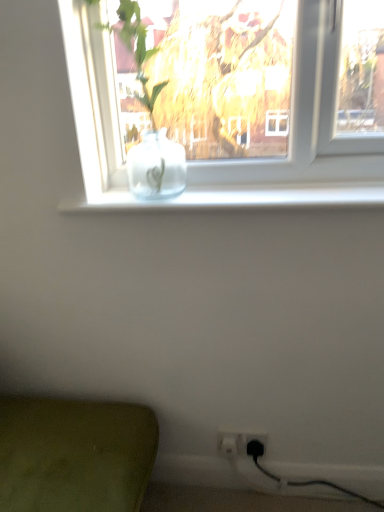
What do you see at coordinates (255, 445) in the screenshot? This screenshot has height=512, width=384. I see `white plastic electric outlet at lower right, which is the second electric outlet in left-to-right order` at bounding box center [255, 445].

What is the approximate width of white plastic electric outlet at lower right, marked as the 1th electric outlet in a right-to-left arrangement?

0.97 inches.

Where is `white plastic electric outlet at lower right, marked as the 1th electric outlet in a right-to-left arrangement`? This screenshot has width=384, height=512. white plastic electric outlet at lower right, marked as the 1th electric outlet in a right-to-left arrangement is located at coordinates (255, 445).

Describe the element at coordinates (242, 444) in the screenshot. I see `white plastic electric outlet at lower right, which appears as the second electric outlet when viewed from the right` at that location.

Where is `white plastic electric outlet at lower right, which appears as the second electric outlet when viewed from the right`? The width and height of the screenshot is (384, 512). white plastic electric outlet at lower right, which appears as the second electric outlet when viewed from the right is located at coordinates (242, 444).

You are a GUI agent. You are given a task and a screenshot of the screen. Output one action in this format:
    pyautogui.click(x=<x>, y=<y>)
    Task: Click on the white plastic electric outlet at lower right, marked as the 1th electric outlet in a right-to-left arrangement
    This screenshot has width=384, height=512.
    Given the screenshot: What is the action you would take?
    pyautogui.click(x=255, y=445)

Considering the positions of objects white plastic electric outlet at lower right, which is the second electric outlet in left-to-right order, and white plastic electric outlet at lower right, which appears as the second electric outlet when viewed from the right, in the image provided, who is more to the right, white plastic electric outlet at lower right, which is the second electric outlet in left-to-right order, or white plastic electric outlet at lower right, which appears as the second electric outlet when viewed from the right,?

white plastic electric outlet at lower right, which is the second electric outlet in left-to-right order, is more to the right.

Does white plastic electric outlet at lower right, marked as the 1th electric outlet in a right-to-left arrangement, come behind white plastic electric outlet at lower right, arranged as the 1th electric outlet when viewed from the left?

That is False.

Which is nearer, (x=255, y=453) or (x=219, y=435)?

The point (x=219, y=435) is closer to the camera.

From the image's perspective, which one is positioned higher, white plastic electric outlet at lower right, which is the second electric outlet in left-to-right order, or white plastic electric outlet at lower right, which appears as the second electric outlet when viewed from the right?

white plastic electric outlet at lower right, which appears as the second electric outlet when viewed from the right, appears higher in the image.

From a real-world perspective, which is physically above, white plastic electric outlet at lower right, marked as the 1th electric outlet in a right-to-left arrangement, or white plastic electric outlet at lower right, which appears as the second electric outlet when viewed from the right?

white plastic electric outlet at lower right, which appears as the second electric outlet when viewed from the right, is physically above.

Considering the relative sizes of white plastic electric outlet at lower right, which is the second electric outlet in left-to-right order, and white plastic electric outlet at lower right, arranged as the 1th electric outlet when viewed from the left, in the image provided, is white plastic electric outlet at lower right, which is the second electric outlet in left-to-right order, wider than white plastic electric outlet at lower right, arranged as the 1th electric outlet when viewed from the left,?

Yes.

Can you confirm if white plastic electric outlet at lower right, which is the second electric outlet in left-to-right order, is taller than white plastic electric outlet at lower right, which appears as the second electric outlet when viewed from the right?

Incorrect, the height of white plastic electric outlet at lower right, which is the second electric outlet in left-to-right order, is not larger of that of white plastic electric outlet at lower right, which appears as the second electric outlet when viewed from the right.

Does white plastic electric outlet at lower right, marked as the 1th electric outlet in a right-to-left arrangement, have a smaller size compared to white plastic electric outlet at lower right, arranged as the 1th electric outlet when viewed from the left?

Indeed, white plastic electric outlet at lower right, marked as the 1th electric outlet in a right-to-left arrangement, has a smaller size compared to white plastic electric outlet at lower right, arranged as the 1th electric outlet when viewed from the left.

Is white plastic electric outlet at lower right, which is the second electric outlet in left-to-right order, not within white plastic electric outlet at lower right, arranged as the 1th electric outlet when viewed from the left?

Actually, white plastic electric outlet at lower right, which is the second electric outlet in left-to-right order, is at least partially inside white plastic electric outlet at lower right, arranged as the 1th electric outlet when viewed from the left.

Is white plastic electric outlet at lower right, marked as the 1th electric outlet in a right-to-left arrangement, beside white plastic electric outlet at lower right, which appears as the second electric outlet when viewed from the right?

Yes, the surface of white plastic electric outlet at lower right, marked as the 1th electric outlet in a right-to-left arrangement, is in contact with white plastic electric outlet at lower right, which appears as the second electric outlet when viewed from the right.

Is white plastic electric outlet at lower right, which is the second electric outlet in left-to-right order, turned away from white plastic electric outlet at lower right, arranged as the 1th electric outlet when viewed from the left?

Yes, white plastic electric outlet at lower right, arranged as the 1th electric outlet when viewed from the left, is at the back of white plastic electric outlet at lower right, which is the second electric outlet in left-to-right order.

Measure the distance from white plastic electric outlet at lower right, marked as the 1th electric outlet in a right-to-left arrangement, to white plastic electric outlet at lower right, arranged as the 1th electric outlet when viewed from the left.

white plastic electric outlet at lower right, marked as the 1th electric outlet in a right-to-left arrangement, and white plastic electric outlet at lower right, arranged as the 1th electric outlet when viewed from the left, are 0.77 inches apart.

Where is `electric outlet located underneath the white plastic electric outlet at lower right, which appears as the second electric outlet when viewed from the right (from a real-world perspective)`? electric outlet located underneath the white plastic electric outlet at lower right, which appears as the second electric outlet when viewed from the right (from a real-world perspective) is located at coordinates (255, 445).

Which object is positioned more to the right, white plastic electric outlet at lower right, arranged as the 1th electric outlet when viewed from the left, or white plastic electric outlet at lower right, marked as the 1th electric outlet in a right-to-left arrangement?

From the viewer's perspective, white plastic electric outlet at lower right, marked as the 1th electric outlet in a right-to-left arrangement, appears more on the right side.

Which object is further away from the camera taking this photo, white plastic electric outlet at lower right, arranged as the 1th electric outlet when viewed from the left, or white plastic electric outlet at lower right, which is the second electric outlet in left-to-right order?

white plastic electric outlet at lower right, arranged as the 1th electric outlet when viewed from the left.

Which is in front, point (222, 437) or point (255, 447)?

The point (255, 447) is closer.

From the image's perspective, which one is positioned lower, white plastic electric outlet at lower right, which appears as the second electric outlet when viewed from the right, or white plastic electric outlet at lower right, marked as the 1th electric outlet in a right-to-left arrangement?

white plastic electric outlet at lower right, marked as the 1th electric outlet in a right-to-left arrangement, appears lower in the image.

From a real-world perspective, is white plastic electric outlet at lower right, which appears as the second electric outlet when viewed from the right, located beneath white plastic electric outlet at lower right, which is the second electric outlet in left-to-right order?

No.

Can you confirm if white plastic electric outlet at lower right, which appears as the second electric outlet when viewed from the right, is wider than white plastic electric outlet at lower right, marked as the 1th electric outlet in a right-to-left arrangement?

In fact, white plastic electric outlet at lower right, which appears as the second electric outlet when viewed from the right, might be narrower than white plastic electric outlet at lower right, marked as the 1th electric outlet in a right-to-left arrangement.

Is white plastic electric outlet at lower right, arranged as the 1th electric outlet when viewed from the left, shorter than white plastic electric outlet at lower right, which is the second electric outlet in left-to-right order?

No, white plastic electric outlet at lower right, arranged as the 1th electric outlet when viewed from the left, is not shorter than white plastic electric outlet at lower right, which is the second electric outlet in left-to-right order.

Is white plastic electric outlet at lower right, which appears as the second electric outlet when viewed from the right, bigger or smaller than white plastic electric outlet at lower right, marked as the 1th electric outlet in a right-to-left arrangement?

white plastic electric outlet at lower right, which appears as the second electric outlet when viewed from the right, is bigger than white plastic electric outlet at lower right, marked as the 1th electric outlet in a right-to-left arrangement.

Is white plastic electric outlet at lower right, which is the second electric outlet in left-to-right order, inside white plastic electric outlet at lower right, which appears as the second electric outlet when viewed from the right?

Yes, white plastic electric outlet at lower right, which is the second electric outlet in left-to-right order, can be found within white plastic electric outlet at lower right, which appears as the second electric outlet when viewed from the right.

Is white plastic electric outlet at lower right, arranged as the 1th electric outlet when viewed from the left, with white plastic electric outlet at lower right, marked as the 1th electric outlet in a right-to-left arrangement?

Yes, white plastic electric outlet at lower right, arranged as the 1th electric outlet when viewed from the left, is beside white plastic electric outlet at lower right, marked as the 1th electric outlet in a right-to-left arrangement.

Is white plastic electric outlet at lower right, which appears as the second electric outlet when viewed from the right, facing towards white plastic electric outlet at lower right, marked as the 1th electric outlet in a right-to-left arrangement?

Yes, white plastic electric outlet at lower right, which appears as the second electric outlet when viewed from the right, is turned towards white plastic electric outlet at lower right, marked as the 1th electric outlet in a right-to-left arrangement.

What's the angular difference between white plastic electric outlet at lower right, which appears as the second electric outlet when viewed from the right, and white plastic electric outlet at lower right, which is the second electric outlet in left-to-right order,'s facing directions?

0.001 degrees.

Locate an element on the screen. electric outlet above the white plastic electric outlet at lower right, which is the second electric outlet in left-to-right order (from a real-world perspective) is located at coordinates (242, 444).

Identify the location of electric outlet on the right side of white plastic electric outlet at lower right, arranged as the 1th electric outlet when viewed from the left. (255, 445).

The width and height of the screenshot is (384, 512). I want to click on electric outlet positioned vertically above the white plastic electric outlet at lower right, which is the second electric outlet in left-to-right order (from a real-world perspective), so click(x=242, y=444).